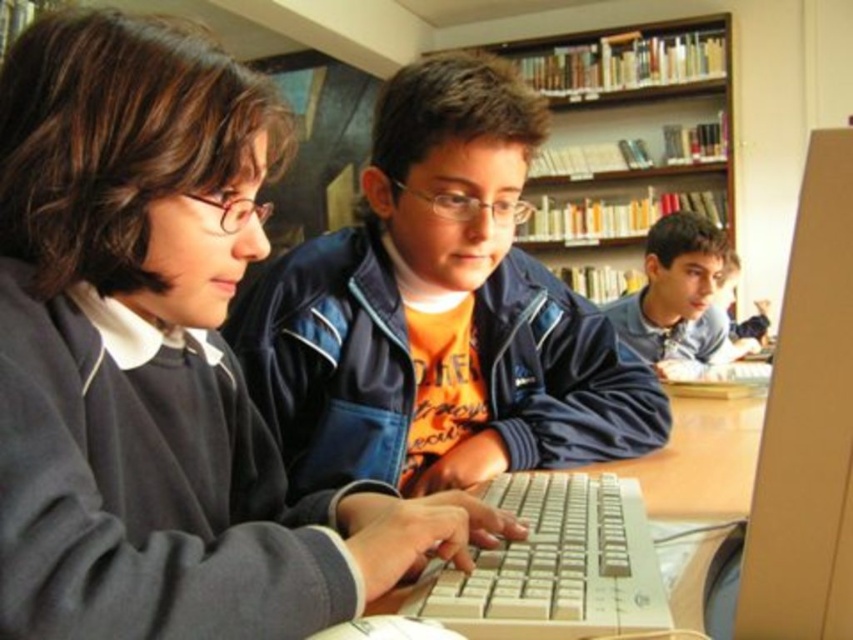
Question: Can you confirm if matte black keyboard at center is thinner than wooden bookshelf at upper center?

Choices:
 (A) no
 (B) yes

Answer: (B)

Question: Which of the following is the farthest from the observer?

Choices:
 (A) (x=581, y=371)
 (B) (x=618, y=326)
 (C) (x=653, y=72)
 (D) (x=764, y=554)

Answer: (C)

Question: Does matte plastic monitor at right have a greater width compared to white plastic keyboard at center?

Choices:
 (A) no
 (B) yes

Answer: (B)

Question: Which of the following is the closest to the observer?

Choices:
 (A) (643, 616)
 (B) (705, 68)
 (C) (816, 188)

Answer: (C)

Question: Which point is farther from the camera taking this photo?

Choices:
 (A) (848, 588)
 (B) (117, 509)
 (C) (647, 237)
 (D) (509, 44)

Answer: (D)

Question: Observing the image, what is the correct spatial positioning of blue fabric jacket at center in reference to white plastic keyboard at center?

Choices:
 (A) below
 (B) above

Answer: (B)